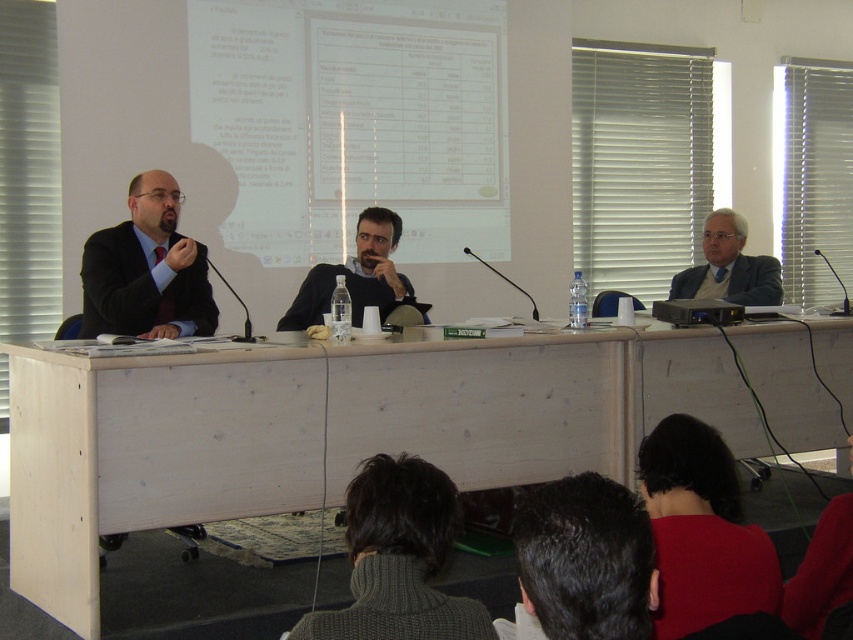
You are an event organizer who needs to arrange name tags for the panelists. The name tags are 10 cm in height. The dark gray sweater at lower center and the white shirt at right are visible in the image. Which panelist should have a name tag placed higher up on their clothing to ensure visibility?

The white shirt at right should have the name tag placed higher up because the dark gray sweater at lower center is not as tall as the white shirt at right, meaning the white shirt at right has a taller torso or clothing height, allowing the name tag to be placed higher while remaining visible.

You are attending a conference and want to sit in a spot where you can see both the dark red sweater at lower right and the dark brown hair at lower center clearly. Based on their positions, which direction should you choose to sit relative to them?

You should sit to the left of both the dark red sweater at lower right and the dark brown hair at lower center because the dark red sweater at lower right is positioned over the dark brown hair at lower center, meaning it is closer to the viewer. Sitting to the left would allow you to see both objects without obstruction.

You are attending a conference and need to identify the speaker wearing a dark gray sweater at lower center. Which direction should you look relative to the white shirt at right to find them?

The dark gray sweater at lower center is located to the left of the white shirt at right, so you should look to the left of the white shirt at right to find the speaker wearing it.